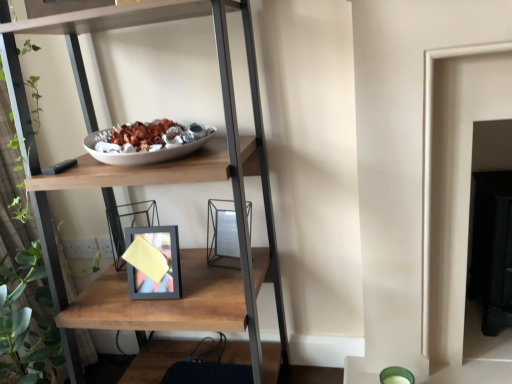
Question: Can you confirm if wooden shelf at center is bigger than metallic silver picture frame at center?

Choices:
 (A) no
 (B) yes

Answer: (B)

Question: Would you say wooden shelf at center is outside metallic silver picture frame at center?

Choices:
 (A) yes
 (B) no

Answer: (A)

Question: Does wooden shelf at center have a smaller size compared to metallic silver picture frame at center?

Choices:
 (A) yes
 (B) no

Answer: (B)

Question: Could you tell me if wooden shelf at center is facing metallic silver picture frame at center?

Choices:
 (A) yes
 (B) no

Answer: (A)

Question: Is wooden shelf at center thinner than metallic silver picture frame at center?

Choices:
 (A) no
 (B) yes

Answer: (A)

Question: Could metallic silver picture frame at center be considered to be inside wooden shelf at center?

Choices:
 (A) no
 (B) yes

Answer: (B)

Question: Is metallic silver picture frame at center to the left of wooden shelf at center from the viewer's perspective?

Choices:
 (A) no
 (B) yes

Answer: (A)

Question: Is metallic silver picture frame at center positioned before wooden shelf at center?

Choices:
 (A) yes
 (B) no

Answer: (B)

Question: Considering the relative sizes of metallic silver picture frame at center and wooden shelf at center in the image provided, is metallic silver picture frame at center shorter than wooden shelf at center?

Choices:
 (A) no
 (B) yes

Answer: (B)

Question: Is metallic silver picture frame at center outside of wooden shelf at center?

Choices:
 (A) no
 (B) yes

Answer: (A)

Question: Considering the relative positions of metallic silver picture frame at center and wooden shelf at center in the image provided, is metallic silver picture frame at center to the right of wooden shelf at center from the viewer's perspective?

Choices:
 (A) yes
 (B) no

Answer: (A)

Question: Does metallic silver picture frame at center turn towards wooden shelf at center?

Choices:
 (A) no
 (B) yes

Answer: (B)

Question: In terms of height, does metallic silver picture frame at center look taller or shorter compared to wooden shelf at center?

Choices:
 (A) tall
 (B) short

Answer: (B)